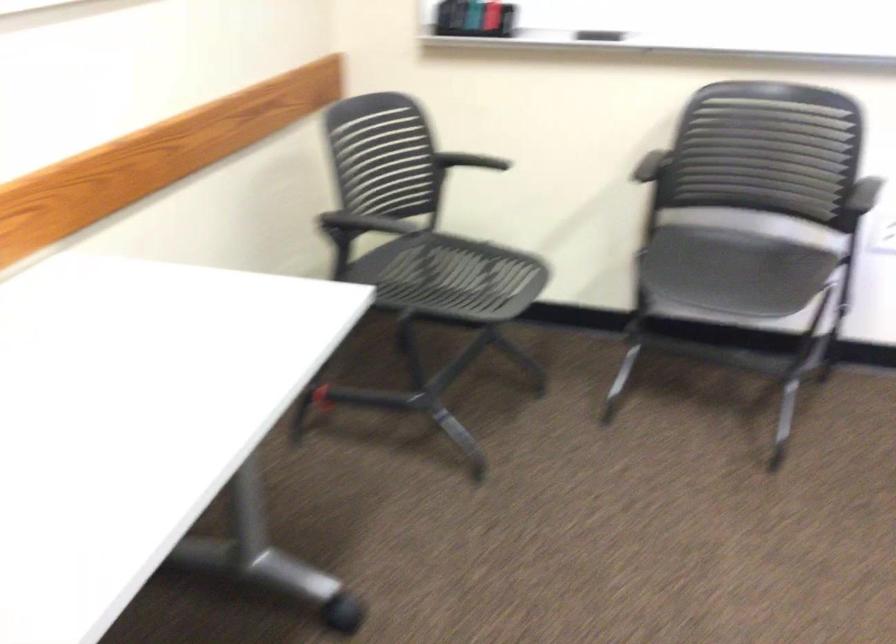
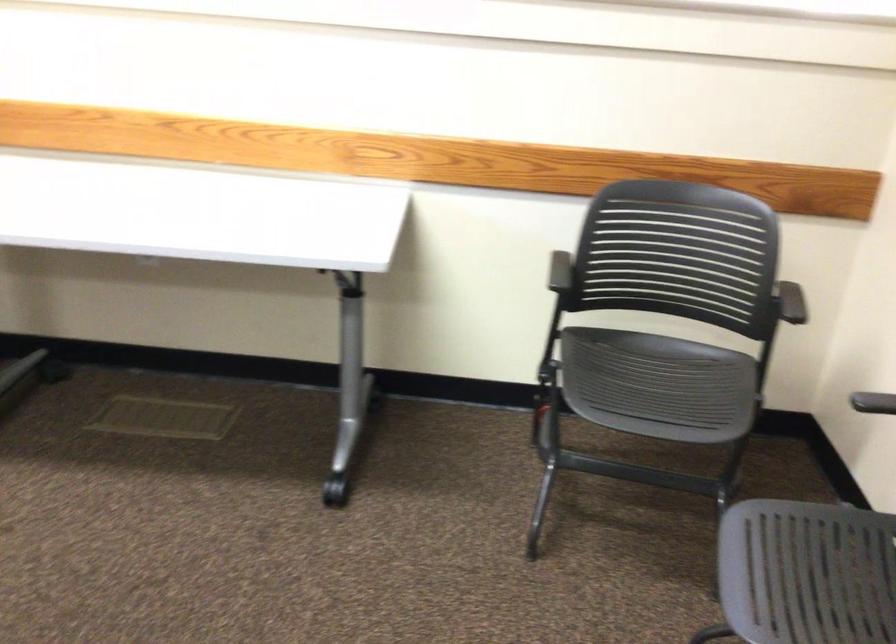
The point at (x=392, y=219) is marked in the first image. Where is the corresponding point in the second image?

(560, 270)